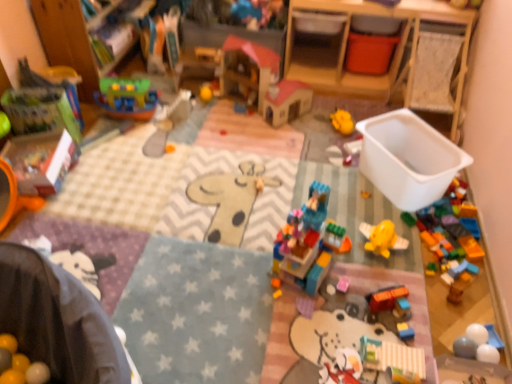
You are a GUI agent. You are given a task and a screenshot of the screen. Output one action in this format:
    pyautogui.click(x=<x>, y=<y>)
    Task: Click on the wooden toy at upper left
    
    Given the screenshot: What is the action you would take?
    pyautogui.click(x=67, y=40)

What do you see at coordinates (393, 56) in the screenshot? The image size is (512, 384). I see `wooden changing table at upper right` at bounding box center [393, 56].

Where is `wooden dollhouse at center, marked as the 2th toy in a top-to-bottom arrangement`? Image resolution: width=512 pixels, height=384 pixels. wooden dollhouse at center, marked as the 2th toy in a top-to-bottom arrangement is located at coordinates (272, 83).

Identify the location of matte plastic dollhouse at upper center, the 1th toy in the top-to-bottom sequence. (260, 13).

Image resolution: width=512 pixels, height=384 pixels. What do you see at coordinates (260, 13) in the screenshot?
I see `matte plastic dollhouse at upper center, the 1th toy in the top-to-bottom sequence` at bounding box center [260, 13].

The height and width of the screenshot is (384, 512). I want to click on wooden toy at upper left, so click(x=67, y=40).

Does translucent plastic airplane at center, placed as the fourth toy when sorted from bottom to top, have a lesser height compared to matte plastic dollhouse at upper center, the 1th toy in the top-to-bottom sequence?

Yes, translucent plastic airplane at center, placed as the fourth toy when sorted from bottom to top, is shorter than matte plastic dollhouse at upper center, the 1th toy in the top-to-bottom sequence.

Are translucent plastic airplane at center, which appears as the seventh toy when viewed from the top, and matte plastic dollhouse at upper center, the 1th toy in the top-to-bottom sequence, far apart?

translucent plastic airplane at center, which appears as the seventh toy when viewed from the top, is far away from matte plastic dollhouse at upper center, the 1th toy in the top-to-bottom sequence.

Considering the points (364, 193) and (254, 3), which point is behind, point (364, 193) or point (254, 3)?

The point (254, 3) is farther.

The height and width of the screenshot is (384, 512). What are the coordinates of `the 4th toy counting from the right side of the wooden dollhouse at center, marked as the 2th toy in a top-to-bottom arrangement` in the screenshot? It's located at tap(385, 298).

Is wooden dollhouse at center, which is counted as the 9th toy, starting from the bottom, next to orange matte car at center, the 2th toy from the bottom, and touching it?

There is a gap between wooden dollhouse at center, which is counted as the 9th toy, starting from the bottom, and orange matte car at center, the 2th toy from the bottom.

Considering the relative sizes of wooden dollhouse at center, marked as the 2th toy in a top-to-bottom arrangement, and orange matte car at center, arranged as the ninth toy when viewed from the top, in the image provided, is wooden dollhouse at center, marked as the 2th toy in a top-to-bottom arrangement, wider than orange matte car at center, arranged as the ninth toy when viewed from the top,?

Indeed, wooden dollhouse at center, marked as the 2th toy in a top-to-bottom arrangement, has a greater width compared to orange matte car at center, arranged as the ninth toy when viewed from the top.

From a real-world perspective, which is physically above, wooden dollhouse at center, which is counted as the 9th toy, starting from the bottom, or orange matte car at center, arranged as the ninth toy when viewed from the top?

wooden dollhouse at center, which is counted as the 9th toy, starting from the bottom.

Where is `changing table beneath the matte plastic dollhouse at upper center, which ranks as the 10th toy in bottom-to-top order (from a real-world perspective)`? changing table beneath the matte plastic dollhouse at upper center, which ranks as the 10th toy in bottom-to-top order (from a real-world perspective) is located at coordinates (393, 56).

From a real-world perspective, between matte plastic dollhouse at upper center, which ranks as the 10th toy in bottom-to-top order, and wooden changing table at upper right, who is vertically higher?

In real-world perspective, matte plastic dollhouse at upper center, which ranks as the 10th toy in bottom-to-top order, is above.

Is matte plastic dollhouse at upper center, which ranks as the 10th toy in bottom-to-top order, shorter than wooden changing table at upper right?

Yes, matte plastic dollhouse at upper center, which ranks as the 10th toy in bottom-to-top order, is shorter than wooden changing table at upper right.

From the image's perspective, is wooden toy at upper left over orange matte car at center, the 2th toy from the bottom?

Yes, from the image's perspective, wooden toy at upper left is on top of orange matte car at center, the 2th toy from the bottom.

Is wooden toy at upper left inside the boundaries of orange matte car at center, arranged as the ninth toy when viewed from the top, or outside?

wooden toy at upper left lies outside orange matte car at center, arranged as the ninth toy when viewed from the top.

Which object is wider, wooden toy at upper left or orange matte car at center, the 2th toy from the bottom?

With larger width is wooden toy at upper left.

Between wooden toy at upper left and orange matte car at center, arranged as the ninth toy when viewed from the top, which one has larger size?

wooden toy at upper left.

Do you think wooden changing table at upper right is within wooden toy at upper left, or outside of it?

wooden changing table at upper right is not inside wooden toy at upper left, it's outside.

Considering the relative sizes of wooden changing table at upper right and wooden toy at upper left in the image provided, is wooden changing table at upper right shorter than wooden toy at upper left?

Correct, wooden changing table at upper right is not as tall as wooden toy at upper left.

From the image's perspective, relative to wooden toy at upper left, is wooden changing table at upper right above or below?

Based on their image positions, wooden changing table at upper right is located beneath wooden toy at upper left.

Does wooden changing table at upper right appear on the left side of wooden toy at upper left?

No.

What's the angular difference between wooden changing table at upper right and pastel striped blocks at center, which appears as the 10th toy when viewed from the top,'s facing directions?

wooden changing table at upper right and pastel striped blocks at center, which appears as the 10th toy when viewed from the top, are facing 90.4 degrees away from each other.

From the picture: Is the position of wooden changing table at upper right more distant than that of pastel striped blocks at center, which appears as the 10th toy when viewed from the top?

Yes, wooden changing table at upper right is further from the viewer.

Between wooden changing table at upper right and pastel striped blocks at center, marked as the 1th toy in a bottom-to-top arrangement, which one has smaller width?

With smaller width is pastel striped blocks at center, marked as the 1th toy in a bottom-to-top arrangement.

Is wooden changing table at upper right shorter than pastel striped blocks at center, which appears as the 10th toy when viewed from the top?

Incorrect, the height of wooden changing table at upper right does not fall short of that of pastel striped blocks at center, which appears as the 10th toy when viewed from the top.

Find the location of `changing table located in front of the yellow matte ball at center, which is the 8th toy from bottom to top`. changing table located in front of the yellow matte ball at center, which is the 8th toy from bottom to top is located at coordinates (393, 56).

Considering the positions of point (439, 15) and point (202, 87), is point (439, 15) closer or farther from the camera than point (202, 87)?

Point (439, 15) is positioned closer to the camera compared to point (202, 87).

Does wooden changing table at upper right turn towards yellow matte ball at center, acting as the 3th toy starting from the top?

No, wooden changing table at upper right is not oriented towards yellow matte ball at center, acting as the 3th toy starting from the top.

Considering the relative positions of wooden changing table at upper right and yellow matte ball at center, which is the 8th toy from bottom to top, in the image provided, is wooden changing table at upper right to the left or to the right of yellow matte ball at center, which is the 8th toy from bottom to top,?

Clearly, wooden changing table at upper right is on the right of yellow matte ball at center, which is the 8th toy from bottom to top, in the image.

The height and width of the screenshot is (384, 512). Find the location of `the 5th toy counting from the right side of the matte plastic dollhouse at upper center, which ranks as the 10th toy in bottom-to-top order`. the 5th toy counting from the right side of the matte plastic dollhouse at upper center, which ranks as the 10th toy in bottom-to-top order is located at coordinates (365, 194).

Where is `the 4th toy counting from the left side of the orange matte car at center, arranged as the ninth toy when viewed from the top`? the 4th toy counting from the left side of the orange matte car at center, arranged as the ninth toy when viewed from the top is located at coordinates (272, 83).

Which object lies further to the anchor point yellow matte ball at center, acting as the 3th toy starting from the top, pastel striped blocks at center, which appears as the 10th toy when viewed from the top, or translucent plastic airplane at center, which appears as the seventh toy when viewed from the top?

pastel striped blocks at center, which appears as the 10th toy when viewed from the top.

Based on their spatial positions, is wooden dollhouse at center, which is counted as the 9th toy, starting from the bottom, or yellow rubber duck at center, which appears as the fifth toy when ordered from the bottom, closer to pastel striped blocks at center, marked as the 1th toy in a bottom-to-top arrangement?

yellow rubber duck at center, which appears as the fifth toy when ordered from the bottom.

Which object lies nearer to the anchor point translucent plastic airplane at center, placed as the fourth toy when sorted from bottom to top, translucent plastic castle at center, marked as the third toy in a bottom-to-top arrangement, or orange matte car at center, the 2th toy from the bottom?

orange matte car at center, the 2th toy from the bottom.

Which object lies nearer to the anchor point pastel striped blocks at center, which appears as the 10th toy when viewed from the top, yellow matte ball at center, acting as the 3th toy starting from the top, or wooden changing table at upper right?

The object closer to pastel striped blocks at center, which appears as the 10th toy when viewed from the top, is wooden changing table at upper right.

From the image, which object appears to be nearer to pastel striped blocks at center, which appears as the 10th toy when viewed from the top, orange matte car at center, the 2th toy from the bottom, or matte green book at left, marked as the 6th toy in a bottom-to-top arrangement?

Among the two, orange matte car at center, the 2th toy from the bottom, is located nearer to pastel striped blocks at center, which appears as the 10th toy when viewed from the top.

From the image, which object appears to be nearer to wooden dollhouse at center, which is counted as the 9th toy, starting from the bottom, orange matte car at center, the 2th toy from the bottom, or yellow rubber duck at center, acting as the 6th toy starting from the top?

The object closer to wooden dollhouse at center, which is counted as the 9th toy, starting from the bottom, is yellow rubber duck at center, acting as the 6th toy starting from the top.

When comparing their distances from translucent plastic airplane at center, placed as the fourth toy when sorted from bottom to top, does yellow rubber duck at center, which appears as the fifth toy when ordered from the bottom, or wooden toy at upper left seem closer?

The object closer to translucent plastic airplane at center, placed as the fourth toy when sorted from bottom to top, is yellow rubber duck at center, which appears as the fifth toy when ordered from the bottom.

Based on their spatial positions, is matte plastic dollhouse at upper center, the 1th toy in the top-to-bottom sequence, or orange matte car at center, arranged as the ninth toy when viewed from the top, further from yellow rubber duck at center, which appears as the fifth toy when ordered from the bottom?

Based on the image, orange matte car at center, arranged as the ninth toy when viewed from the top, appears to be further to yellow rubber duck at center, which appears as the fifth toy when ordered from the bottom.

The width and height of the screenshot is (512, 384). In order to click on toy positioned between pastel striped blocks at center, which appears as the 10th toy when viewed from the top, and translucent plastic airplane at center, which appears as the seventh toy when viewed from the top, from near to far in this screenshot , I will do `click(385, 298)`.

Find the location of `bookshelf between matte green book at left, acting as the 5th toy starting from the top, and matte plastic dollhouse at upper center, the 1th toy in the top-to-bottom sequence, from left to right`. bookshelf between matte green book at left, acting as the 5th toy starting from the top, and matte plastic dollhouse at upper center, the 1th toy in the top-to-bottom sequence, from left to right is located at coordinates (67, 40).

Find the location of a particular element. toy between translucent plastic castle at center, marked as the third toy in a bottom-to-top arrangement, and pastel striped blocks at center, marked as the 1th toy in a bottom-to-top arrangement, in the up-down direction is located at coordinates (385, 298).

Identify the location of changing table between matte plastic dollhouse at upper center, the 1th toy in the top-to-bottom sequence, and pastel striped blocks at center, which appears as the 10th toy when viewed from the top, in the vertical direction. (393, 56).